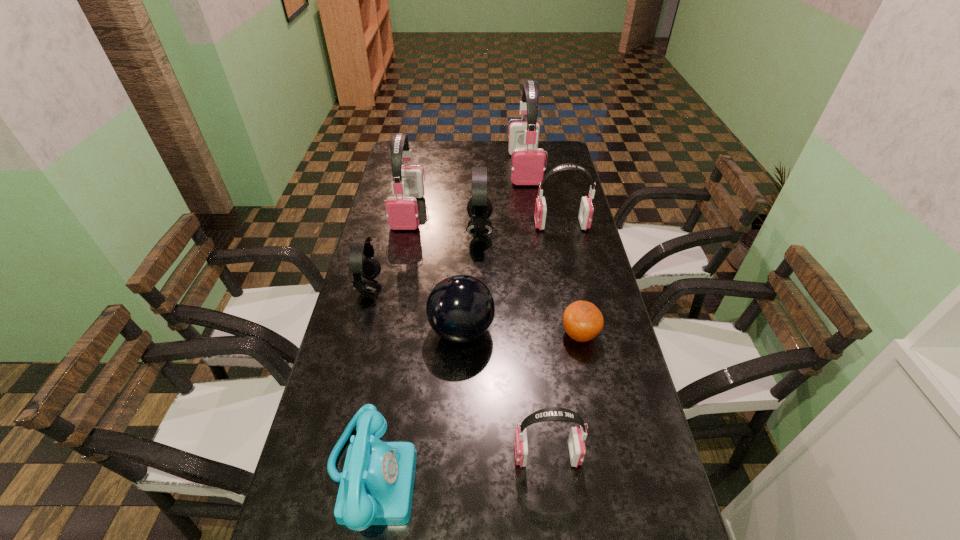
Locate an element on the screen. vacant space that is in between the biggest pink earphone and the fourth earphone from right to left is located at coordinates (502, 199).

The width and height of the screenshot is (960, 540). What are the coordinates of `vacant area that lies between the leftmost pink earphone and the black bowling ball` in the screenshot? It's located at (435, 271).

At what (x,y) coordinates should I click in order to perform the action: click on the closest object relative to the third earphone from left to right. Please return your answer as a coordinate pair (x, y). Looking at the image, I should click on (586, 210).

I want to click on the second closest object to the bigger black earphone, so click(402, 212).

Select which earphone is the second closest to the second biggest pink earphone. Please provide its 2D coordinates. Your answer should be formatted as a tuple, i.e. [(x, y)], where the tuple contains the x and y coordinates of a point satisfying the conditions above.

[(368, 267)]

I want to click on earphone that is the third closest one to the tallest object, so click(x=402, y=212).

Select which pink earphone appears as the closest to the farther black earphone. Please provide its 2D coordinates. Your answer should be formatted as a tuple, i.e. [(x, y)], where the tuple contains the x and y coordinates of a point satisfying the conditions above.

[(586, 210)]

At what (x,y) coordinates should I click in order to perform the action: click on pink earphone that is the second closest to the fourth earphone from right to left. Please return your answer as a coordinate pair (x, y). Image resolution: width=960 pixels, height=540 pixels. Looking at the image, I should click on (402, 212).

I want to click on free region that satisfies the following two spatial constraints: 1. on the ear cups of the orange; 2. on the left side of the bigger black earphone, so click(479, 335).

What are the coordinates of `vacant position in the image that satisfies the following two spatial constraints: 1. on the ear cups of the farther black earphone; 2. on the left side of the orange orange` in the screenshot? It's located at (479, 335).